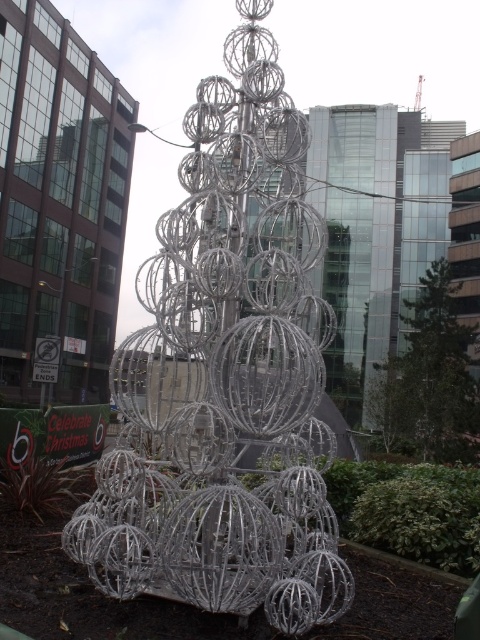
Based on the photo, is metallic wire sculpture at center thinner than clear glass tree at center?

Indeed, metallic wire sculpture at center has a lesser width compared to clear glass tree at center.

Measure the distance between metallic wire sculpture at center and clear glass tree at center.

metallic wire sculpture at center and clear glass tree at center are 17.06 meters apart from each other.

You are a GUI agent. You are given a task and a screenshot of the screen. Output one action in this format:
    pyautogui.click(x=<x>, y=<y>)
    Task: Click on the metallic wire sculpture at center
    This screenshot has width=480, height=640.
    Given the screenshot: What is the action you would take?
    (x=226, y=374)

Where is `metallic wire sculpture at center`? metallic wire sculpture at center is located at coordinates (226, 374).